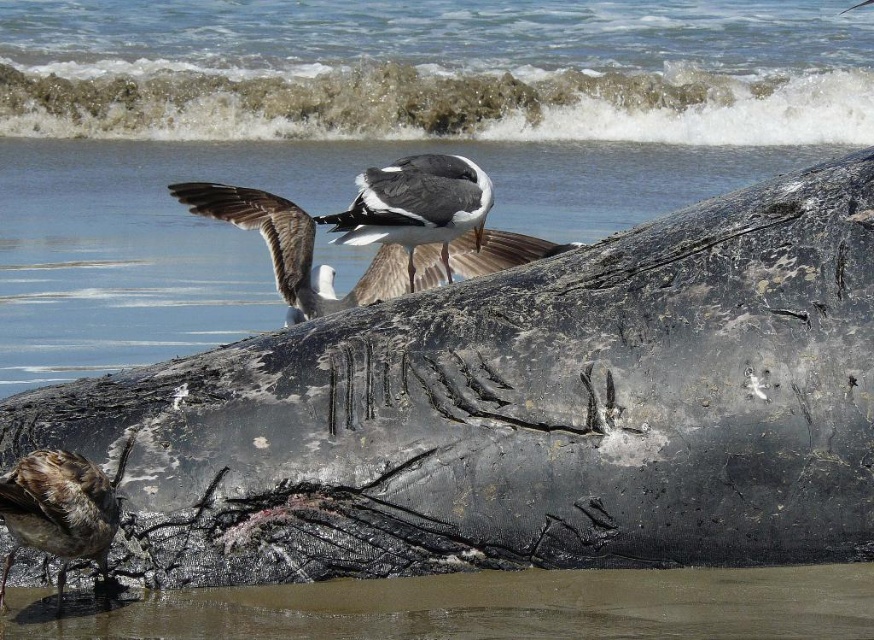
Question: Is charred wood log at center bigger than smooth sand beach at lower center?

Choices:
 (A) yes
 (B) no

Answer: (A)

Question: Which object appears farthest from the camera in this image?

Choices:
 (A) brown speckled feathers at lower left
 (B) brown feathered seagull at center

Answer: (B)

Question: Does charred wood log at center appear over black textured whale at center?

Choices:
 (A) yes
 (B) no

Answer: (B)

Question: Which object is closer to the camera taking this photo?

Choices:
 (A) black textured whale at center
 (B) brown speckled feathers at lower left
 (C) charred wood log at center
 (D) smooth sand beach at lower center

Answer: (B)

Question: Can you confirm if charred wood log at center is positioned to the left of black textured whale at center?

Choices:
 (A) yes
 (B) no

Answer: (B)

Question: Which of the following is the farthest from the observer?

Choices:
 (A) charred wood log at center
 (B) brown speckled feathers at lower left

Answer: (A)